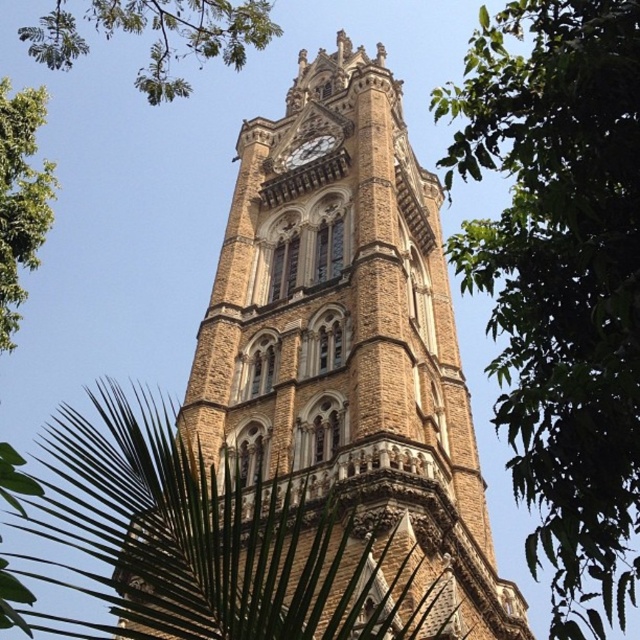
You are an architect designing a new garden layout around the clock tower. You need to ensure that the gold textured clock at center remains visible from the main pathway. Considering the green leafy tree at upper left, will its height block the view of the clock from the pathway?

The green leafy tree at upper left has a greater height compared to the gold textured clock at center. This means the tree could potentially block the view of the clock from the pathway, so adjustments to the tree placement or pruning may be necessary to maintain visibility.

You are standing in front of the clock tower and want to take a photo that includes both the green leafy tree at right and the green leafy tree at upper left. Which tree is closer to the bottom of the photo frame?

The green leafy tree at right is located below the green leafy tree at upper left, so it will be closer to the bottom of the photo frame.